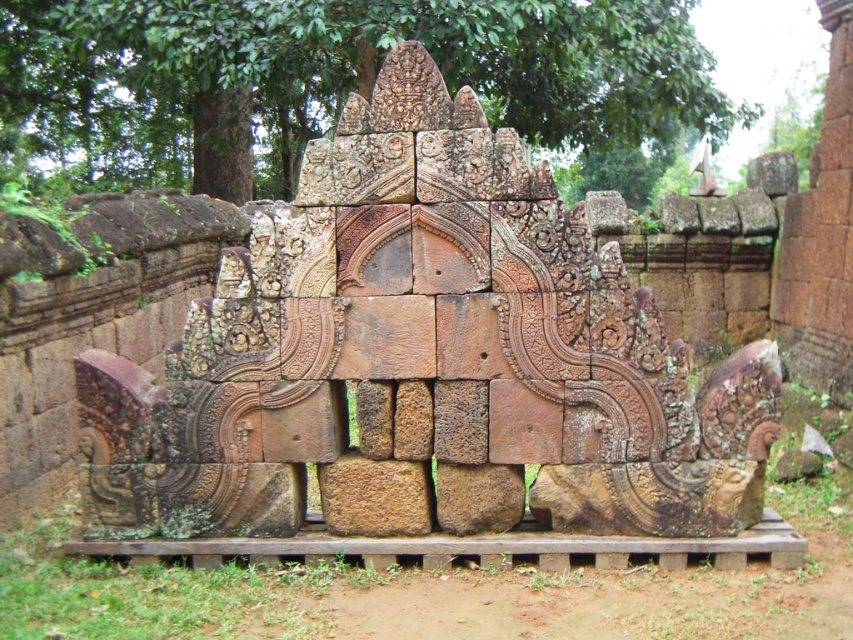
Between rustic stone sculpture at center and green leafy tree at upper center, which one appears on the left side from the viewer's perspective?

Positioned to the left is rustic stone sculpture at center.

Between rustic stone sculpture at center and green leafy tree at upper center, which one appears on the right side from the viewer's perspective?

Positioned to the right is green leafy tree at upper center.

Does point (619, 454) lie in front of point (363, 88)?

Yes, it is.

You are a GUI agent. You are given a task and a screenshot of the screen. Output one action in this format:
    pyautogui.click(x=<x>, y=<y>)
    Task: Click on the rustic stone sculpture at center
    
    Given the screenshot: What is the action you would take?
    pyautogui.click(x=422, y=358)